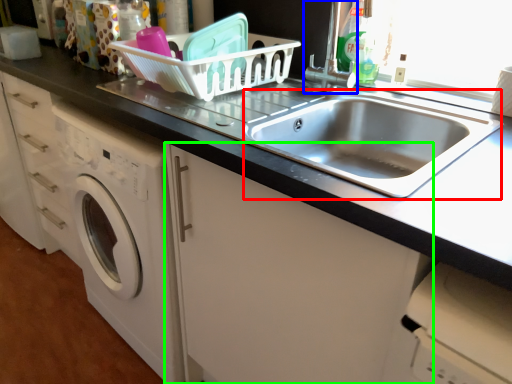
Question: Which object is the farthest from sink (highlighted by a red box)? Choose among these: faucet (highlighted by a blue box) or cabinetry (highlighted by a green box).

Choices:
 (A) faucet
 (B) cabinetry

Answer: (B)